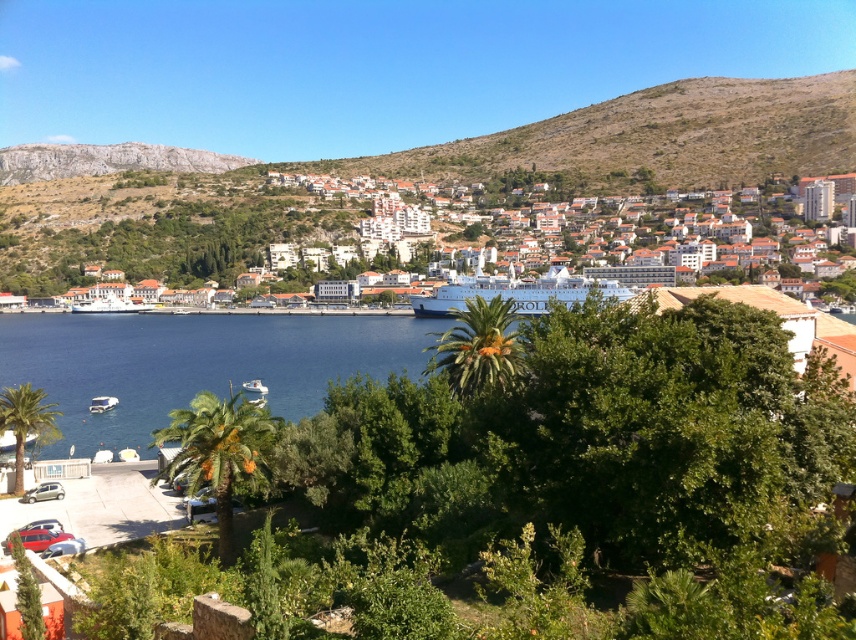
Question: Which object is farther from the camera taking this photo?

Choices:
 (A) white textured buildings at center
 (B) white glossy cruise ship at center
 (C) white glossy boat at lower left
 (D) white matte boat at lower left

Answer: (A)

Question: Is white textured buildings at center further to the viewer compared to brown rocky hillside at center?

Choices:
 (A) yes
 (B) no

Answer: (B)

Question: Is brown rocky hillside at center positioned at the back of white matte boat at lower left?

Choices:
 (A) no
 (B) yes

Answer: (B)

Question: Is blue water at center positioned in front of brown rocky hillside at center?

Choices:
 (A) no
 (B) yes

Answer: (B)

Question: Which of the following is the closest to the observer?

Choices:
 (A) (525, 292)
 (B) (64, 380)
 (C) (116, 397)

Answer: (C)

Question: Which point is farther to the camera?

Choices:
 (A) blue water at center
 (B) white glossy cruise ship at center
 (C) white glossy boat at lower left
 (D) brown rocky hillside at center

Answer: (D)